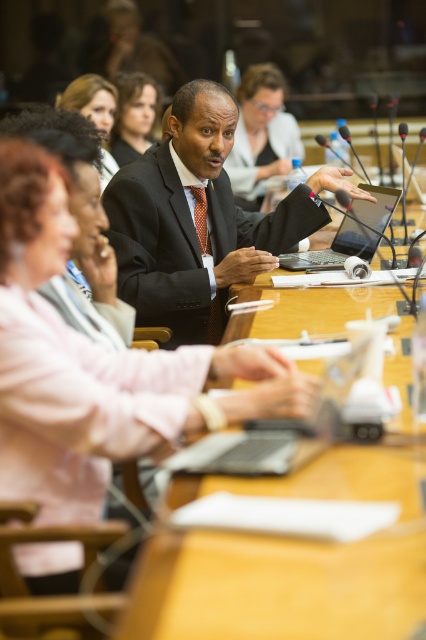
Is silver metallic laptop at center below matte black hair at upper center?

Yes.

Between silver metallic laptop at center and matte black hair at upper center, which one has less height?

With less height is silver metallic laptop at center.

Is point (267, 474) farther from camera compared to point (131, 134)?

No.

The image size is (426, 640). What are the coordinates of `silver metallic laptop at center` in the screenshot? It's located at (276, 433).

Can you confirm if matte black hair at upper center is thinner than matte black hair at upper left?

Indeed, matte black hair at upper center has a lesser width compared to matte black hair at upper left.

Between point (118, 156) and point (115, 88), which one is positioned in front?

Point (115, 88) is more forward.

The width and height of the screenshot is (426, 640). Identify the location of matte black hair at upper center. (132, 116).

Which is in front, point (103, 81) or point (201, 248)?

Point (201, 248) is in front.

Can you confirm if matte black hair at upper left is positioned below red silk tie at center?

No.

Which is in front, point (112, 157) or point (207, 234)?

Point (207, 234) is more forward.

Where is `matte black hair at upper left`? The image size is (426, 640). matte black hair at upper left is located at coordinates (92, 100).